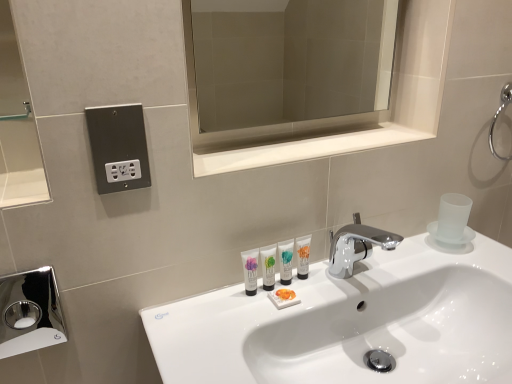
I want to click on free space in front of white glossy tube at center, positioned as the first mouthwash in right-to-left order, so click(278, 319).